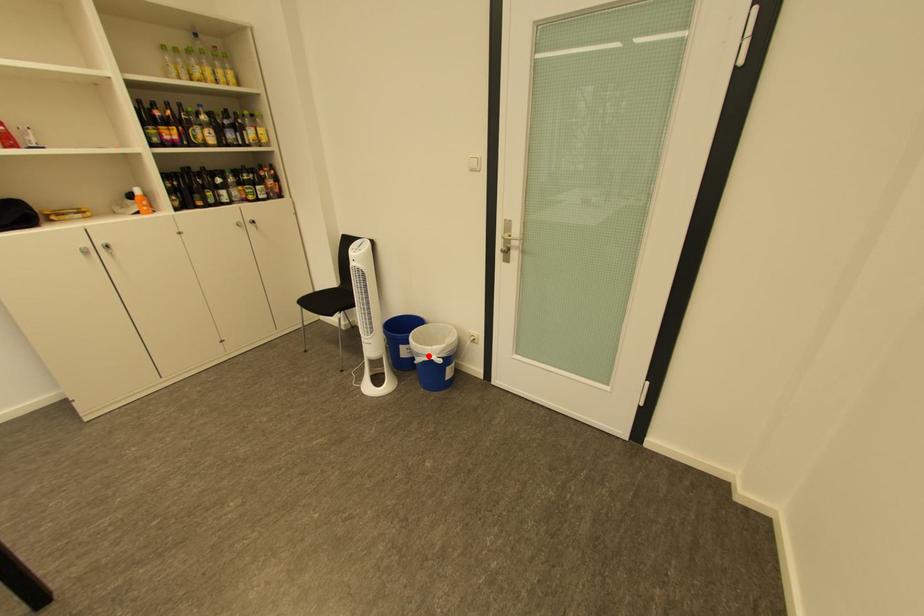
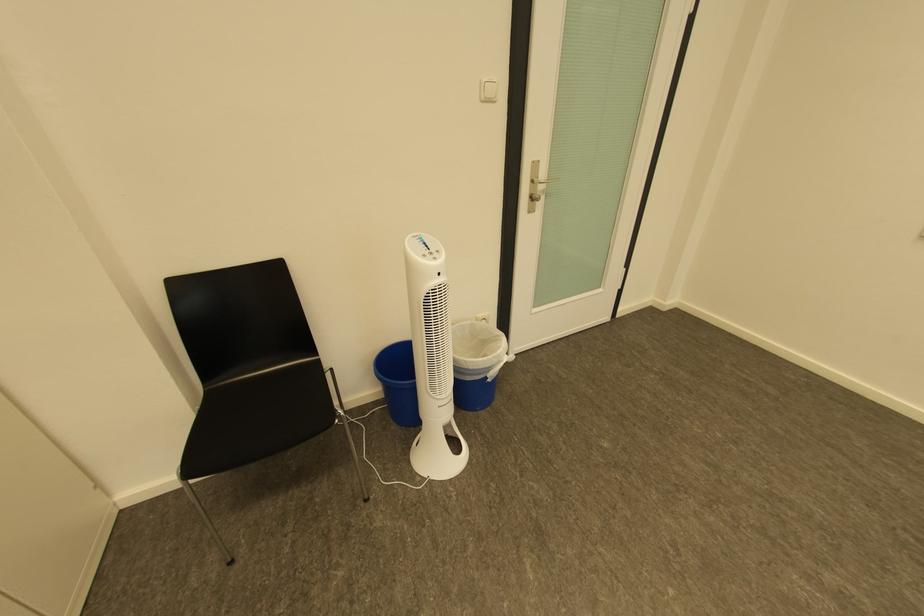
In the second image, find the point that corresponds to the highlighted location in the first image.

(499, 370)